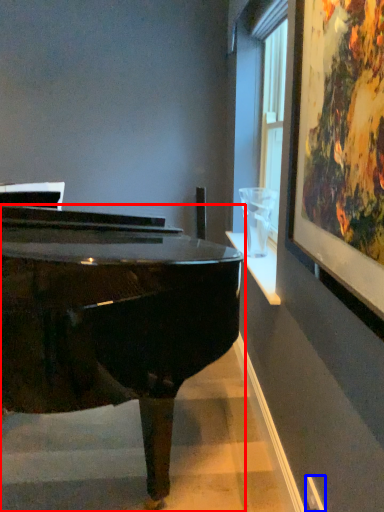
Question: Which object appears closest to the camera in this image, piano (highlighted by a red box) or power outlet (highlighted by a blue box)?

Choices:
 (A) piano
 (B) power outlet

Answer: (A)